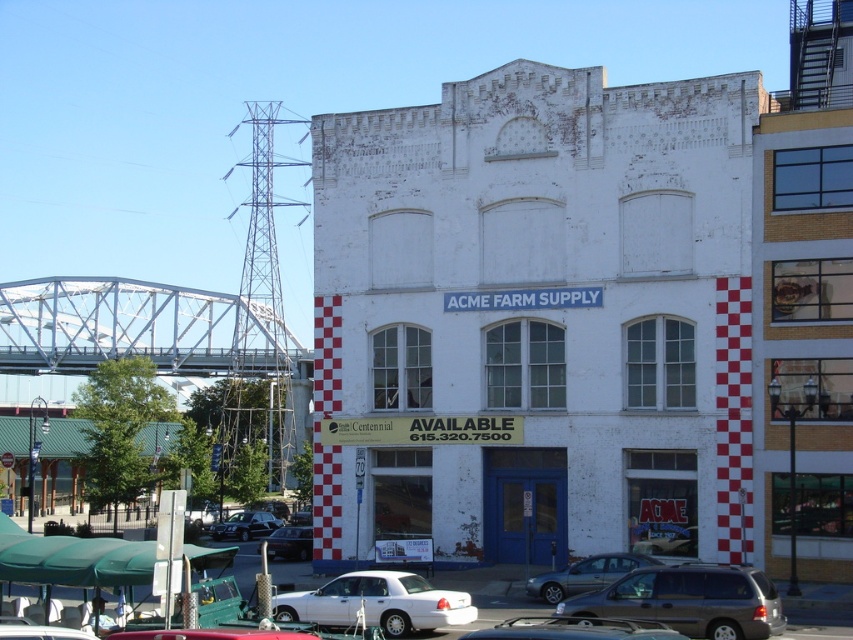
Is white brick building at center positioned at the back of shiny black sedan at lower left?

No, white brick building at center is closer to the viewer.

Locate an element on the screen. The image size is (853, 640). white brick building at center is located at coordinates (535, 321).

Which is behind, point (405, 436) or point (221, 532)?

Point (221, 532)

The image size is (853, 640). I want to click on white brick building at center, so click(x=535, y=321).

Is white brick building at center to the left of white matte sedan at center from the viewer's perspective?

Indeed, white brick building at center is positioned on the left side of white matte sedan at center.

Which of these two, white brick building at center or white matte sedan at center, stands shorter?

With less height is white matte sedan at center.

Between point (500, 547) and point (585, 625), which one is positioned in front?

Positioned in front is point (585, 625).

Identify the location of white brick building at center. tap(535, 321).

Does point (630, 570) come closer to viewer compared to point (250, 522)?

That is True.

In order to click on silver metallic sedan at lower center in this screenshot , I will do `click(585, 576)`.